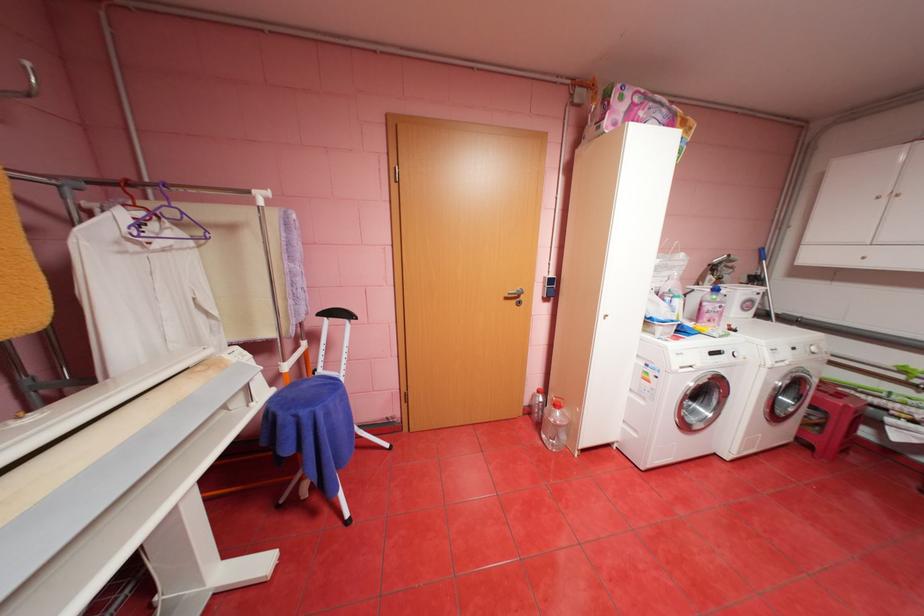
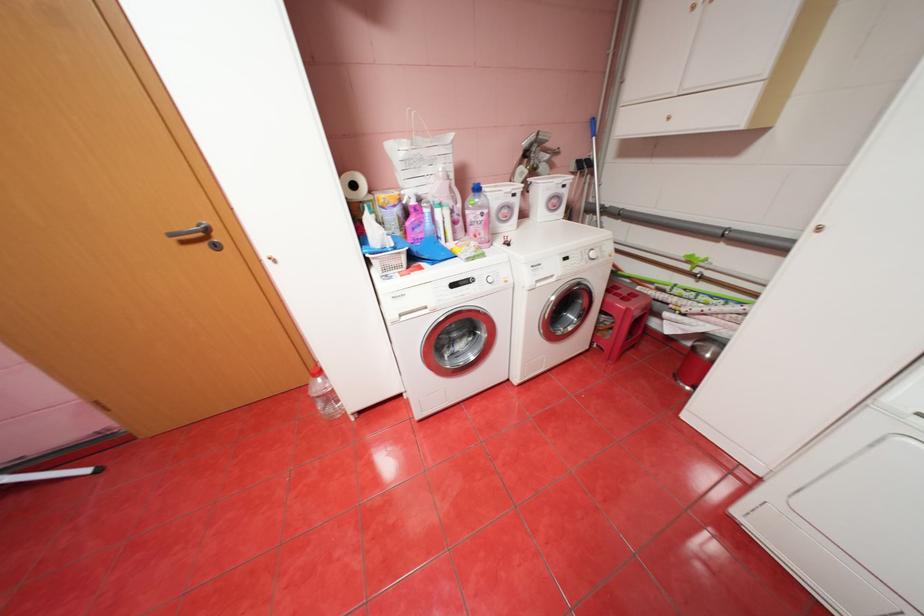
In the second image, find the point that corresponds to pixel 821 349 in the first image.

(602, 254)